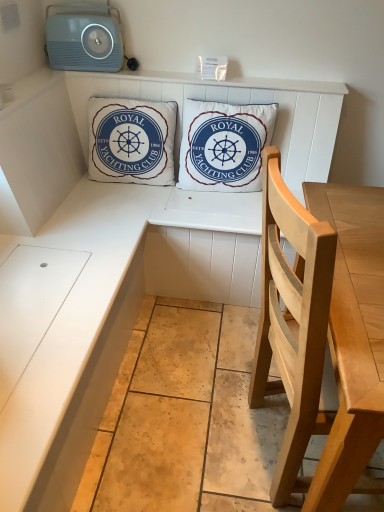
Question: Is white cotton cushion at center, the first pillow in the right-to-left sequence, far from light wood chair at right?

Choices:
 (A) yes
 (B) no

Answer: (B)

Question: Is white cotton cushion at center, the second pillow viewed from the left, located outside light wood chair at right?

Choices:
 (A) no
 (B) yes

Answer: (B)

Question: Does white cotton cushion at center, the first pillow in the right-to-left sequence, have a larger size compared to light wood chair at right?

Choices:
 (A) yes
 (B) no

Answer: (B)

Question: Is white cotton cushion at center, the second pillow viewed from the left, wider than light wood chair at right?

Choices:
 (A) yes
 (B) no

Answer: (B)

Question: Considering the relative positions of white cotton cushion at center, the first pillow in the right-to-left sequence, and light wood chair at right in the image provided, is white cotton cushion at center, the first pillow in the right-to-left sequence, to the right of light wood chair at right from the viewer's perspective?

Choices:
 (A) no
 (B) yes

Answer: (A)

Question: Looking at their shapes, would you say white cotton cushion at center, which ranks as the 2th pillow in right-to-left order, is wider or thinner than white cotton cushion at center, the first pillow in the right-to-left sequence?

Choices:
 (A) thin
 (B) wide

Answer: (A)

Question: Is white cotton cushion at center, marked as the 1th pillow in a left-to-right arrangement, taller or shorter than white cotton cushion at center, the second pillow viewed from the left?

Choices:
 (A) tall
 (B) short

Answer: (A)

Question: Does point (137, 136) appear closer or farther from the camera than point (206, 189)?

Choices:
 (A) farther
 (B) closer

Answer: (B)

Question: Considering the relative positions of white cotton cushion at center, which ranks as the 2th pillow in right-to-left order, and white cotton cushion at center, the second pillow viewed from the left, in the image provided, is white cotton cushion at center, which ranks as the 2th pillow in right-to-left order, to the left or to the right of white cotton cushion at center, the second pillow viewed from the left,?

Choices:
 (A) right
 (B) left

Answer: (B)

Question: Considering the positions of point (77, 45) and point (188, 180), is point (77, 45) closer or farther from the camera than point (188, 180)?

Choices:
 (A) farther
 (B) closer

Answer: (B)

Question: In the image, is light blue plastic stereo at upper left on the left side or the right side of white cotton cushion at center, the second pillow viewed from the left?

Choices:
 (A) left
 (B) right

Answer: (A)

Question: Is light blue plastic stereo at upper left inside or outside of white cotton cushion at center, the first pillow in the right-to-left sequence?

Choices:
 (A) inside
 (B) outside

Answer: (B)

Question: In terms of size, does light blue plastic stereo at upper left appear bigger or smaller than white cotton cushion at center, the first pillow in the right-to-left sequence?

Choices:
 (A) big
 (B) small

Answer: (B)

Question: Is white cotton cushion at center, which ranks as the 2th pillow in right-to-left order, wider or thinner than light blue plastic stereo at upper left?

Choices:
 (A) thin
 (B) wide

Answer: (B)

Question: Is white cotton cushion at center, marked as the 1th pillow in a left-to-right arrangement, taller or shorter than light blue plastic stereo at upper left?

Choices:
 (A) short
 (B) tall

Answer: (B)